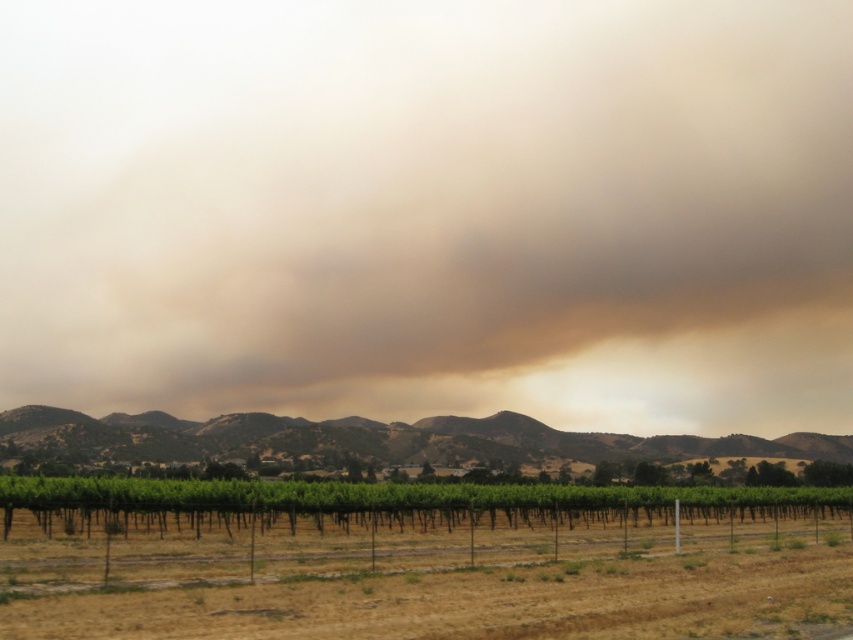
Which is above, brown/dusty cloud at upper center or green leafy vineyard at center?

Positioned higher is brown/dusty cloud at upper center.

Can you confirm if brown/dusty cloud at upper center is thinner than green leafy vineyard at center?

Incorrect, brown/dusty cloud at upper center's width is not less than green leafy vineyard at center's.

Locate an element on the screen. The height and width of the screenshot is (640, 853). brown/dusty cloud at upper center is located at coordinates (430, 211).

Is brown/dusty cloud at upper center taller than green grassy hill at center?

Yes, brown/dusty cloud at upper center is taller than green grassy hill at center.

Between brown/dusty cloud at upper center and green grassy hill at center, which one has more height?

Standing taller between the two is brown/dusty cloud at upper center.

Which is behind, point (606, 262) or point (169, 419)?

The point (606, 262) is behind.

Find the location of `brown/dusty cloud at upper center`. brown/dusty cloud at upper center is located at coordinates (430, 211).

Is green leafy vineyard at center above green grassy hill at center?

Correct, green leafy vineyard at center is located above green grassy hill at center.

Does green leafy vineyard at center come behind green grassy hill at center?

No, it is in front of green grassy hill at center.

This screenshot has width=853, height=640. Identify the location of green leafy vineyard at center. (418, 560).